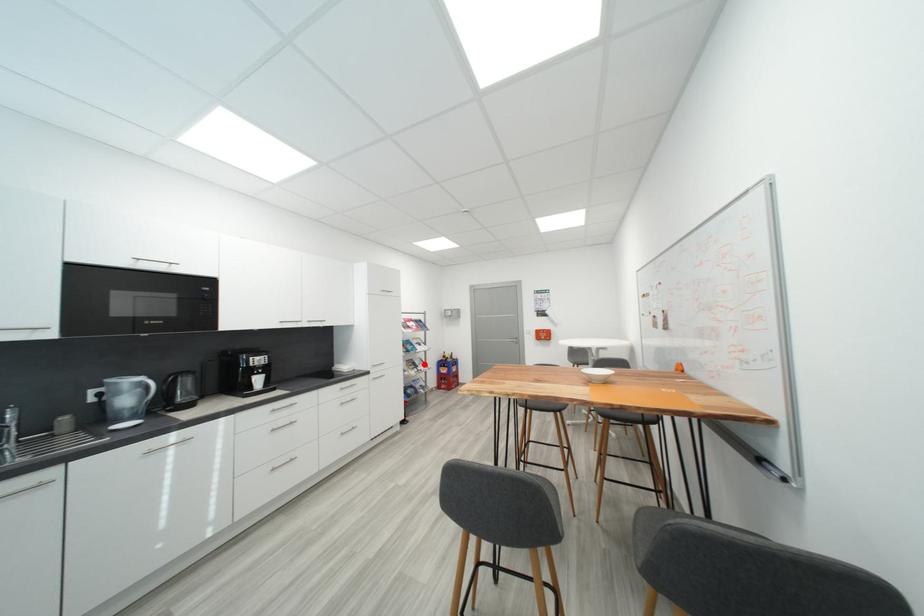
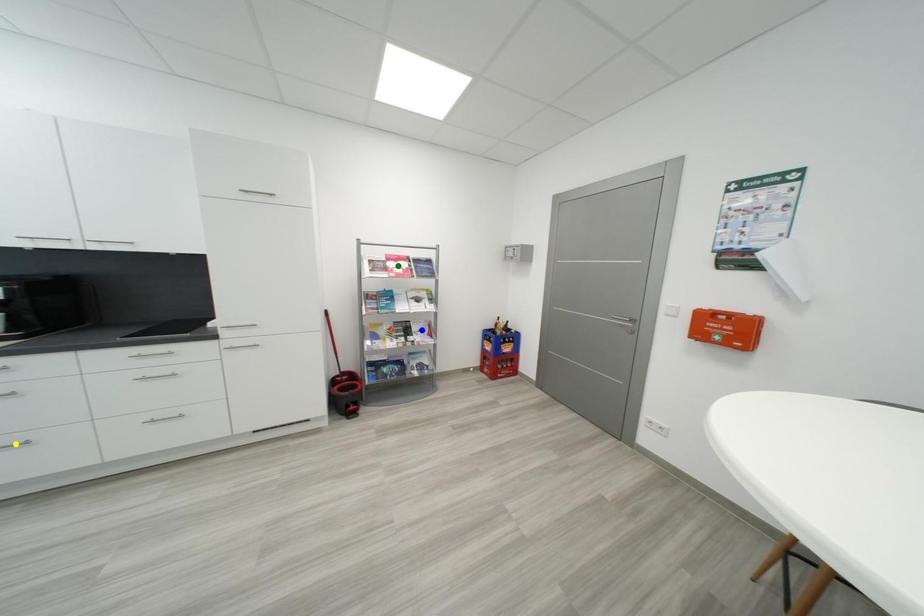
Question: I am providing you with two images of the same scene from different viewpoints. A red point is marked on the first image. You are given multiple points on the second image. In image 2, which mark is for the same physical point as the one in image 1?

Choices:
 (A) blue point
 (B) yellow point
 (C) green point

Answer: (A)